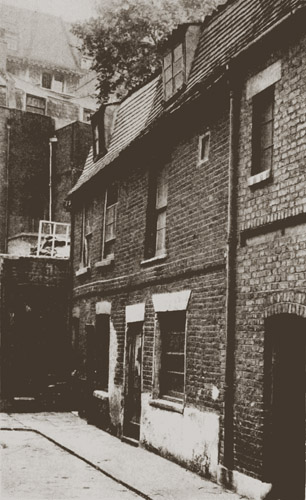
This screenshot has width=306, height=500. Find the location of `attic window`. attic window is located at coordinates (102, 127), (176, 67).